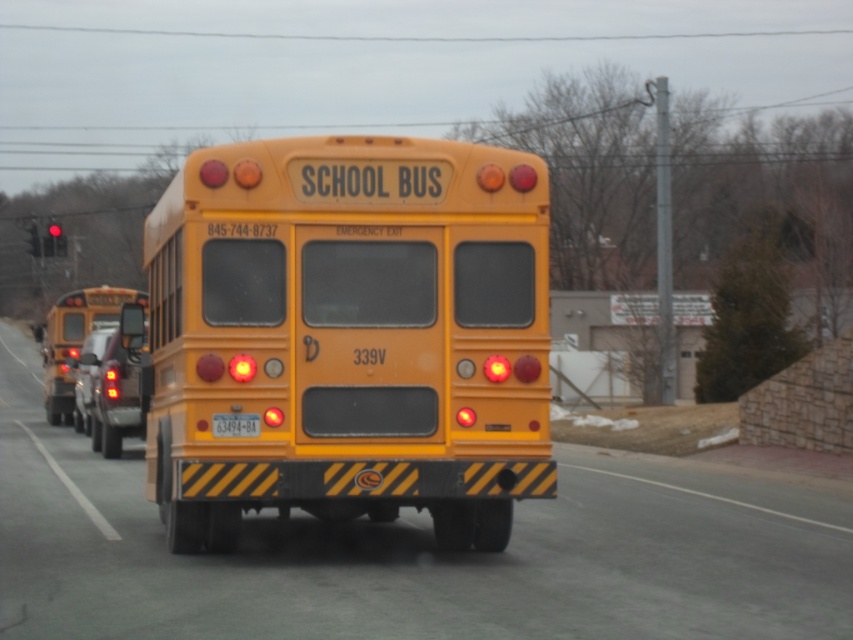
Which of these two, matte black car at center or shiny silver car at rear left, stands taller?

matte black car at center

Who is lower down, matte black car at center or shiny silver car at rear left?

shiny silver car at rear left

Identify the location of matte black car at center. Image resolution: width=853 pixels, height=640 pixels. click(x=119, y=385).

Who is positioned more to the left, yellow matte school bus at rear or shiny silver car at rear left?

Positioned to the left is yellow matte school bus at rear.

Can you confirm if yellow matte school bus at rear is positioned below shiny silver car at rear left?

Actually, yellow matte school bus at rear is above shiny silver car at rear left.

Is point (68, 412) less distant than point (82, 364)?

No, (68, 412) is behind (82, 364).

Find the location of `yellow matte school bus at rear`. yellow matte school bus at rear is located at coordinates (74, 339).

Is the position of yellow matte school bus at rear less distant than that of matte black car at center?

No, yellow matte school bus at rear is behind matte black car at center.

Can you confirm if yellow matte school bus at rear is smaller than matte black car at center?

No, yellow matte school bus at rear is not smaller than matte black car at center.

Does point (76, 333) come closer to viewer compared to point (131, 332)?

No, it is not.

The height and width of the screenshot is (640, 853). Find the location of `yellow matte school bus at rear`. yellow matte school bus at rear is located at coordinates (74, 339).